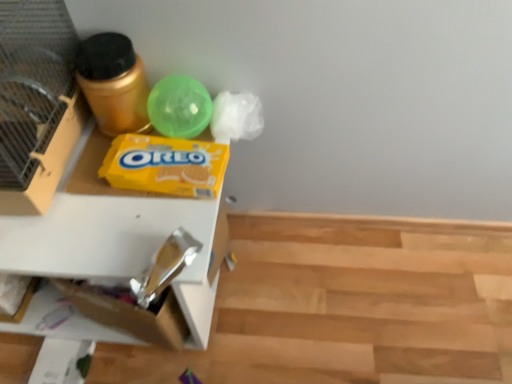
This screenshot has height=384, width=512. I want to click on free space in front of yellow cardboard oreo box at center, so click(x=146, y=226).